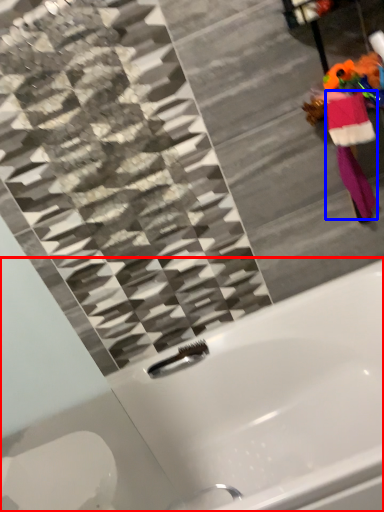
Question: Among these objects, which one is nearest to the camera, bathtub (highlighted by a red box) or robe (highlighted by a blue box)?

Choices:
 (A) bathtub
 (B) robe

Answer: (A)